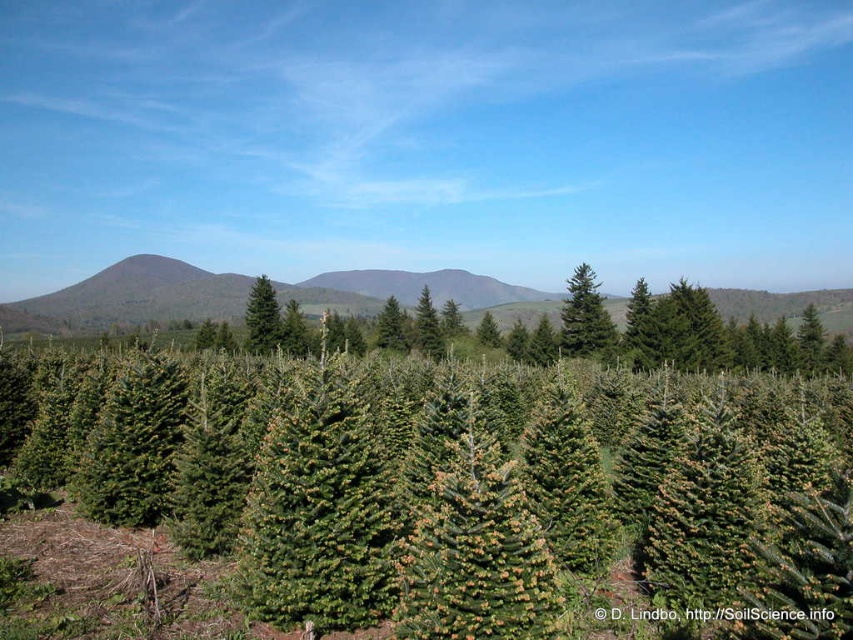
Question: Can you confirm if green needle-like tree at center is thinner than green matte evergreen tree at center?

Choices:
 (A) no
 (B) yes

Answer: (B)

Question: Is green matte forest at center positioned at the back of green matte evergreen tree at center?

Choices:
 (A) yes
 (B) no

Answer: (A)

Question: Can you confirm if green matte forest at center is positioned to the right of green matte evergreen tree at center?

Choices:
 (A) no
 (B) yes

Answer: (B)

Question: Which of the following is the farthest from the observer?

Choices:
 (A) green matte evergreen tree at center
 (B) green matte forest at center
 (C) green needle-like tree at center

Answer: (B)

Question: Which of the following is the closest to the observer?

Choices:
 (A) green needle-like tree at center
 (B) green matte forest at center
 (C) green matte evergreen tree at center

Answer: (A)

Question: Which point is farther from the camera taking this photo?

Choices:
 (A) (254, 326)
 (B) (561, 346)

Answer: (B)